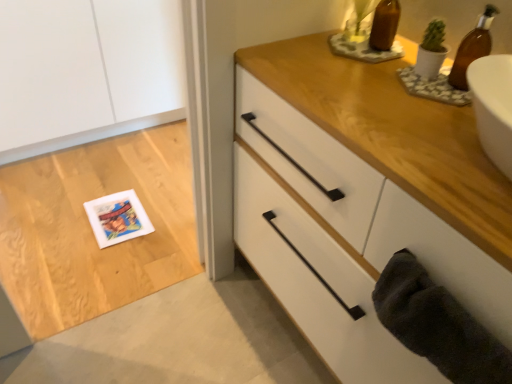
Question: From a real-world perspective, is brown glass bottle at upper right above or below white matte chest of drawers at upper right?

Choices:
 (A) above
 (B) below

Answer: (A)

Question: Considering the positions of brown glass bottle at upper right and white matte chest of drawers at upper right in the image, is brown glass bottle at upper right taller or shorter than white matte chest of drawers at upper right?

Choices:
 (A) tall
 (B) short

Answer: (B)

Question: Which object is positioned closest to the brown glass bottle at upper right?

Choices:
 (A) dark gray plush bath towel at lower right
 (B) white matte postcard at lower left
 (C) brown glass bottle at upper right
 (D) white matte chest of drawers at upper right

Answer: (C)

Question: Estimate the real-world distances between objects in this image. Which object is farther from the white matte chest of drawers at upper right?

Choices:
 (A) white matte postcard at lower left
 (B) brown glass bottle at upper right
 (C) dark gray plush bath towel at lower right
 (D) brown glass bottle at upper right

Answer: (A)